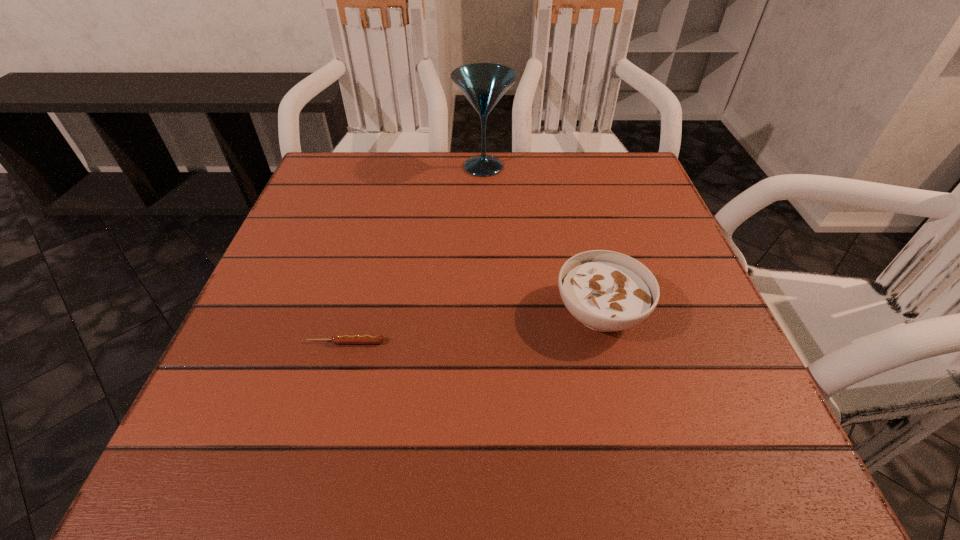
This screenshot has height=540, width=960. In order to click on the tallest object in this screenshot , I will do `click(483, 84)`.

In order to click on the farthest object in this screenshot , I will do `click(483, 84)`.

Image resolution: width=960 pixels, height=540 pixels. I want to click on the second shortest object, so click(606, 291).

The image size is (960, 540). I want to click on the rightmost object, so click(606, 291).

Where is `the leftmost object`? the leftmost object is located at coordinates (336, 339).

Image resolution: width=960 pixels, height=540 pixels. Find the location of `the shortest object`. the shortest object is located at coordinates (336, 339).

This screenshot has width=960, height=540. In order to click on vacant space located on the front of the farthest object in this screenshot , I will do `click(485, 286)`.

Find the location of a particular element. The image size is (960, 540). blank area located 0.360m on the back of the second shortest object is located at coordinates (565, 177).

Locate an element on the screen. This screenshot has width=960, height=540. vacant region located on the back of the shortest object is located at coordinates (354, 312).

At what (x,y) coordinates should I click in order to perform the action: click on object that is positioned at the far edge. Please return your answer as a coordinate pair (x, y). The image size is (960, 540). Looking at the image, I should click on (483, 84).